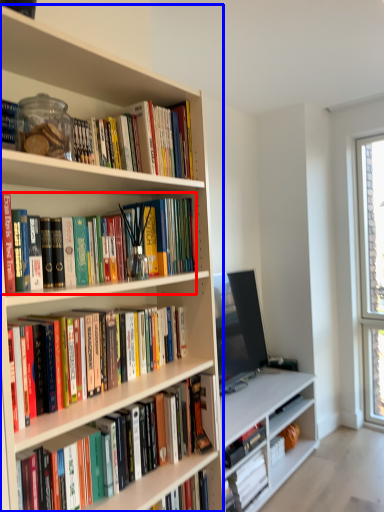
Question: Among these objects, which one is farthest to the camera, book (highlighted by a red box) or bookcase (highlighted by a blue box)?

Choices:
 (A) book
 (B) bookcase

Answer: (A)